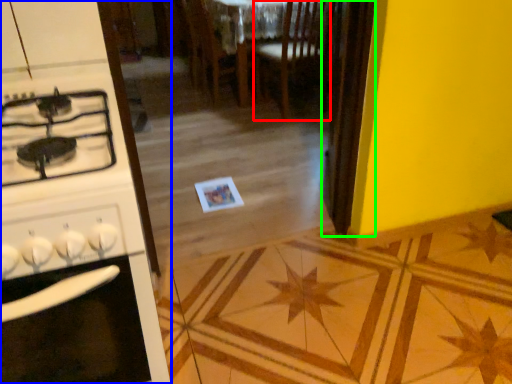
Question: Considering the real-world distances, which object is closest to chair (highlighted by a red box)? kitchen appliance (highlighted by a blue box) or screen door (highlighted by a green box).

Choices:
 (A) kitchen appliance
 (B) screen door

Answer: (B)